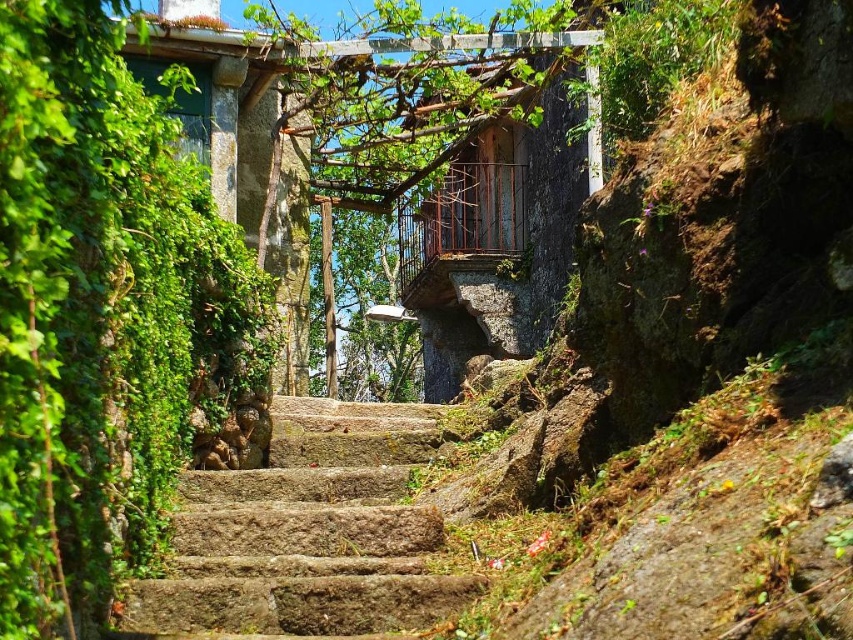
Can you confirm if green leafy ivy at left is thinner than rusty stone stairs at center?

Indeed, green leafy ivy at left has a lesser width compared to rusty stone stairs at center.

From the picture: Is the position of green leafy ivy at left less distant than that of rusty stone stairs at center?

Yes, green leafy ivy at left is closer to the viewer.

Is point (59, 202) less distant than point (399, 474)?

Yes, point (59, 202) is closer to viewer.

Where is `green leafy ivy at left`? The width and height of the screenshot is (853, 640). green leafy ivy at left is located at coordinates (102, 310).